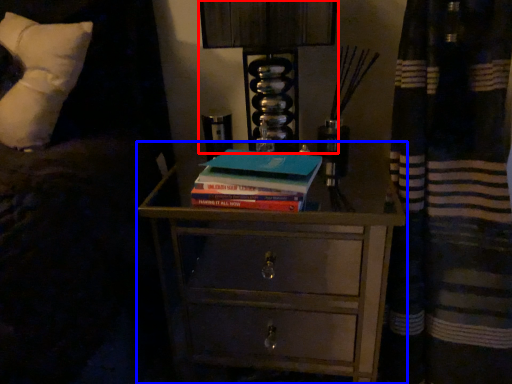
Question: Which object appears closest to the camera in this image, bedside lamp (highlighted by a red box) or chest of drawers (highlighted by a blue box)?

Choices:
 (A) bedside lamp
 (B) chest of drawers

Answer: (B)